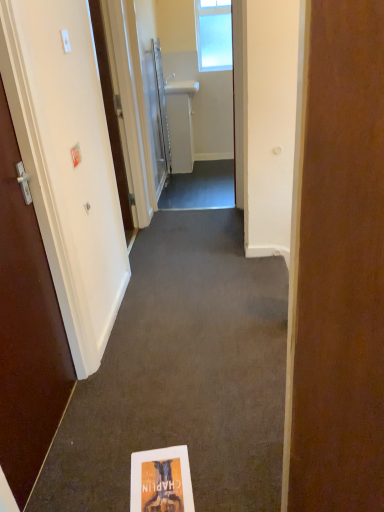
Question: Considering the relative sizes of white paper book at center and white glossy door at left, placed as the fourth door when sorted from back to front, in the image provided, is white paper book at center bigger than white glossy door at left, placed as the fourth door when sorted from back to front,?

Choices:
 (A) no
 (B) yes

Answer: (A)

Question: Considering the relative positions of white paper book at center and white glossy door at left, which appears as the 1th door when viewed from the front, in the image provided, is white paper book at center to the right of white glossy door at left, which appears as the 1th door when viewed from the front, from the viewer's perspective?

Choices:
 (A) yes
 (B) no

Answer: (A)

Question: Considering the relative sizes of white paper book at center and white glossy door at left, placed as the fourth door when sorted from back to front, in the image provided, is white paper book at center thinner than white glossy door at left, placed as the fourth door when sorted from back to front,?

Choices:
 (A) yes
 (B) no

Answer: (B)

Question: Is white paper book at center wider than white glossy door at left, placed as the fourth door when sorted from back to front?

Choices:
 (A) no
 (B) yes

Answer: (B)

Question: Does white paper book at center appear on the left side of white glossy door at left, placed as the fourth door when sorted from back to front?

Choices:
 (A) no
 (B) yes

Answer: (A)

Question: Based on their sizes in the image, would you say white paper book at center is bigger or smaller than matte paper flyer at lower center?

Choices:
 (A) big
 (B) small

Answer: (A)

Question: Is white paper book at center in front of or behind matte paper flyer at lower center in the image?

Choices:
 (A) front
 (B) behind

Answer: (A)

Question: Looking at their shapes, would you say white paper book at center is wider or thinner than matte paper flyer at lower center?

Choices:
 (A) wide
 (B) thin

Answer: (B)

Question: Is white paper book at center situated inside matte paper flyer at lower center or outside?

Choices:
 (A) inside
 (B) outside

Answer: (B)

Question: Considering the positions of white matte door at left, arranged as the 3th door when viewed from the front, and white glossy towel rack at upper center, which is the 4th door in front-to-back order, in the image, is white matte door at left, arranged as the 3th door when viewed from the front, wider or thinner than white glossy towel rack at upper center, which is the 4th door in front-to-back order,?

Choices:
 (A) wide
 (B) thin

Answer: (A)

Question: Is white matte door at left, arranged as the 3th door when viewed from the front, taller or shorter than white glossy towel rack at upper center, which is the 4th door in front-to-back order?

Choices:
 (A) short
 (B) tall

Answer: (A)

Question: Considering the positions of point pyautogui.click(x=99, y=52) and point pyautogui.click(x=155, y=97), is point pyautogui.click(x=99, y=52) closer or farther from the camera than point pyautogui.click(x=155, y=97)?

Choices:
 (A) farther
 (B) closer

Answer: (B)

Question: Is white matte door at left, arranged as the 3th door when viewed from the front, spatially inside white glossy towel rack at upper center, which is the 4th door in front-to-back order, or outside of it?

Choices:
 (A) inside
 (B) outside

Answer: (B)

Question: Is point (124, 220) positioned closer to the camera than point (115, 504)?

Choices:
 (A) farther
 (B) closer

Answer: (A)

Question: Considering the positions of white matte door at left, arranged as the 3th door when viewed from the front, and white paper book at center in the image, is white matte door at left, arranged as the 3th door when viewed from the front, bigger or smaller than white paper book at center?

Choices:
 (A) small
 (B) big

Answer: (B)